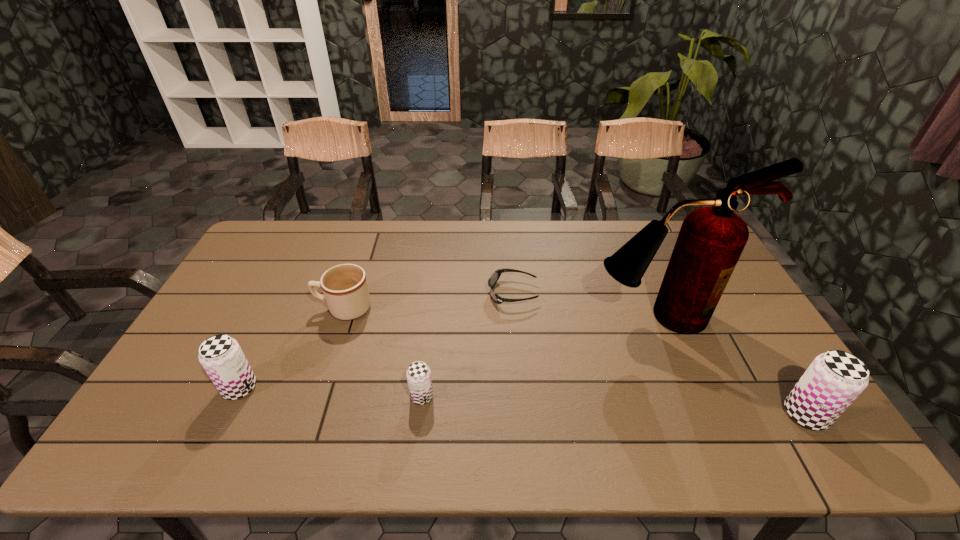
You are a GUI agent. You are given a task and a screenshot of the screen. Output one action in this format:
    pyautogui.click(x=<x>, y=<y>)
    Task: Click on the free spot located 0.310m on the left of the second shortest object
    The image size is (960, 540).
    Given the screenshot: What is the action you would take?
    pyautogui.click(x=288, y=396)

Where is `vacant space positioned on the left of the rightmost beer can`? vacant space positioned on the left of the rightmost beer can is located at coordinates (683, 414).

Identify the location of free space located 0.260m at the nozzle of the fire extinguisher. The image size is (960, 540). (703, 416).

Identify the location of blank area located 0.170m on the side of the second object from left to right with the handle. Image resolution: width=960 pixels, height=540 pixels. (261, 308).

The image size is (960, 540). Identify the location of vacant space located on the side of the second object from left to right with the handle. (222, 308).

Locate an element on the screen. The width and height of the screenshot is (960, 540). free location located 0.280m on the side of the second object from left to right with the handle is located at coordinates (225, 308).

Where is `vacant space located on the lenses of the shortest object`? This screenshot has height=540, width=960. vacant space located on the lenses of the shortest object is located at coordinates (369, 293).

Locate an element on the screen. Image resolution: width=960 pixels, height=540 pixels. free space located 0.360m on the lenses of the shortest object is located at coordinates (374, 293).

Image resolution: width=960 pixels, height=540 pixels. In order to click on vacant region located on the lenses of the shortest object in this screenshot , I will do `click(409, 293)`.

Locate an element on the screen. object present at the left edge is located at coordinates coord(221,356).